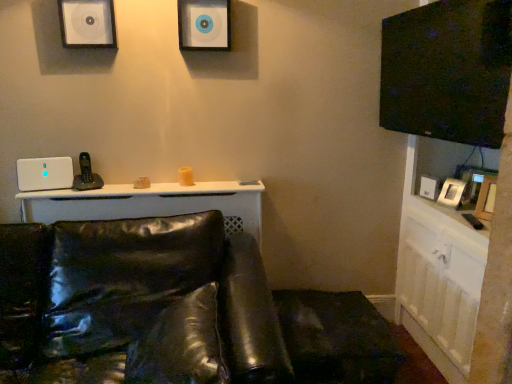
At what (x,y) coordinates should I click in order to perform the action: click on matte white speaker at upper center, the first speaker from the right. Please return your answer as a coordinate pair (x, y). Image resolution: width=512 pixels, height=384 pixels. Looking at the image, I should click on (204, 24).

Describe the element at coordinates (87, 23) in the screenshot. This screenshot has height=384, width=512. I see `white matte speaker at upper left, marked as the second speaker in a top-to-bottom arrangement` at that location.

I want to click on white plastic speaker at left, which is the first speaker from left to right, so click(45, 173).

In the image, there is a white plastic speaker at left, which is the first speaker from left to right. Where is `studio couch below it (from a real-world perspective)`? This screenshot has width=512, height=384. studio couch below it (from a real-world perspective) is located at coordinates (173, 310).

Between white plastic speaker at left, positioned as the third speaker in top-to-bottom order, and glossy leather couch at lower left, which one has smaller width?

white plastic speaker at left, positioned as the third speaker in top-to-bottom order, is thinner.

Does white plastic speaker at left, which appears as the third speaker when viewed from the right, come behind glossy leather couch at lower left?

Yes, white plastic speaker at left, which appears as the third speaker when viewed from the right, is behind glossy leather couch at lower left.

Based on the photo, is white plastic speaker at left, placed as the 1th speaker when sorted from bottom to top, beside glossy leather couch at lower left?

They are not placed beside each other.

Are glossy leather couch at lower left and white matte speaker at upper left, placed as the 2th speaker when sorted from left to right, making contact?

glossy leather couch at lower left and white matte speaker at upper left, placed as the 2th speaker when sorted from left to right, are clearly separated.

Does point (214, 376) lie behind point (83, 41)?

That is False.

Is glossy leather couch at lower left aimed at white matte speaker at upper left, marked as the second speaker in a bottom-to-top arrangement?

No, glossy leather couch at lower left does not turn towards white matte speaker at upper left, marked as the second speaker in a bottom-to-top arrangement.

Is point (434, 154) more distant than point (60, 11)?

Yes, it is behind point (60, 11).

Is white glossy dresser at right oriented away from white matte speaker at upper left, marked as the second speaker in a bottom-to-top arrangement?

No.

Which object is more forward, white glossy dresser at right or white matte speaker at upper left, marked as the second speaker in a top-to-bottom arrangement?

white glossy dresser at right is closer to the camera.

From a real-world perspective, is white glossy dresser at right located beneath white matte speaker at upper left, marked as the second speaker in a top-to-bottom arrangement?

Yes, from a real-world perspective, white glossy dresser at right is beneath white matte speaker at upper left, marked as the second speaker in a top-to-bottom arrangement.

Consider the image. Is white matte speaker at upper left, marked as the second speaker in a top-to-bottom arrangement, aimed at matte white speaker at upper center, the first speaker from the right?

No.

Is white matte speaker at upper left, placed as the 2th speaker when sorted from left to right, outside of matte white speaker at upper center, positioned as the 1th speaker in top-to-bottom order?

Yes.

Considering the points (81, 14) and (207, 6), which point is behind, point (81, 14) or point (207, 6)?

The point (207, 6) is farther.

Is glossy leather couch at lower left shorter than matte white speaker at upper center, the first speaker from the right?

In fact, glossy leather couch at lower left may be taller than matte white speaker at upper center, the first speaker from the right.

The height and width of the screenshot is (384, 512). In order to click on studio couch below the matte white speaker at upper center, the first speaker from the right (from a real-world perspective) in this screenshot , I will do `click(173, 310)`.

Is glossy leather couch at lower left touching matte white speaker at upper center, positioned as the 1th speaker in top-to-bottom order?

No, glossy leather couch at lower left is not with matte white speaker at upper center, positioned as the 1th speaker in top-to-bottom order.

Considering the relative sizes of glossy leather couch at lower left and matte white speaker at upper center, which is the 3th speaker from left to right, in the image provided, is glossy leather couch at lower left thinner than matte white speaker at upper center, which is the 3th speaker from left to right,?

No, glossy leather couch at lower left is not thinner than matte white speaker at upper center, which is the 3th speaker from left to right.

Is white matte speaker at upper left, arranged as the second speaker when viewed from the right, taller or shorter than white glossy dresser at right?

In the image, white matte speaker at upper left, arranged as the second speaker when viewed from the right, appears to be shorter than white glossy dresser at right.

Where is `the 1st speaker behind the white glossy dresser at right`? This screenshot has width=512, height=384. the 1st speaker behind the white glossy dresser at right is located at coordinates point(87,23).

Consider the image. Considering the sizes of objects white matte speaker at upper left, marked as the second speaker in a bottom-to-top arrangement, and white glossy dresser at right in the image provided, who is bigger, white matte speaker at upper left, marked as the second speaker in a bottom-to-top arrangement, or white glossy dresser at right?

white glossy dresser at right is bigger.

Is matte white speaker at upper center, the 3th speaker positioned from the bottom, bigger than white matte speaker at upper left, marked as the second speaker in a bottom-to-top arrangement?

Yes.

Considering the positions of objects matte white speaker at upper center, the 3th speaker positioned from the bottom, and white matte speaker at upper left, marked as the second speaker in a top-to-bottom arrangement, in the image provided, who is more to the left, matte white speaker at upper center, the 3th speaker positioned from the bottom, or white matte speaker at upper left, marked as the second speaker in a top-to-bottom arrangement,?

white matte speaker at upper left, marked as the second speaker in a top-to-bottom arrangement.

Is matte white speaker at upper center, positioned as the 1th speaker in top-to-bottom order, facing towards white matte speaker at upper left, placed as the 2th speaker when sorted from left to right?

No, matte white speaker at upper center, positioned as the 1th speaker in top-to-bottom order, is not oriented towards white matte speaker at upper left, placed as the 2th speaker when sorted from left to right.

From a real-world perspective, is matte white speaker at upper center, the first speaker from the right, located beneath white matte speaker at upper left, placed as the 2th speaker when sorted from left to right?

Yes, from a real-world perspective, matte white speaker at upper center, the first speaker from the right, is below white matte speaker at upper left, placed as the 2th speaker when sorted from left to right.

This screenshot has width=512, height=384. In order to click on the 1st speaker above when counting from the glossy leather couch at lower left (from the image's perspective) in this screenshot , I will do `click(45, 173)`.

Identify the location of studio couch directly beneath the white matte speaker at upper left, arranged as the second speaker when viewed from the right (from a real-world perspective). 173,310.

Considering their positions, is white matte speaker at upper left, arranged as the second speaker when viewed from the right, positioned further to white glossy dresser at right than glossy leather couch at lower left?

white matte speaker at upper left, arranged as the second speaker when viewed from the right, is positioned further to the anchor white glossy dresser at right.

Considering their positions, is white plastic speaker at left, positioned as the third speaker in top-to-bottom order, positioned further to white glossy dresser at right than glossy leather couch at lower left?

The object further to white glossy dresser at right is white plastic speaker at left, positioned as the third speaker in top-to-bottom order.

Considering their positions, is white plastic speaker at left, which appears as the third speaker when viewed from the right, positioned further to white glossy dresser at right than matte white speaker at upper center, the 3th speaker positioned from the bottom?

white plastic speaker at left, which appears as the third speaker when viewed from the right.

Which object lies further to the anchor point glossy leather couch at lower left, white matte speaker at upper left, marked as the second speaker in a bottom-to-top arrangement, or matte white speaker at upper center, positioned as the 1th speaker in top-to-bottom order?

Among the two, white matte speaker at upper left, marked as the second speaker in a bottom-to-top arrangement, is located further to glossy leather couch at lower left.

Looking at the image, which one is located further to white glossy dresser at right, glossy leather couch at lower left or white matte speaker at upper left, marked as the second speaker in a top-to-bottom arrangement?

The object further to white glossy dresser at right is white matte speaker at upper left, marked as the second speaker in a top-to-bottom arrangement.

Which object lies further to the anchor point glossy leather couch at lower left, matte white speaker at upper center, the first speaker from the right, or white matte speaker at upper left, marked as the second speaker in a bottom-to-top arrangement?

white matte speaker at upper left, marked as the second speaker in a bottom-to-top arrangement.

Considering their positions, is glossy leather couch at lower left positioned further to white matte speaker at upper left, marked as the second speaker in a bottom-to-top arrangement, than white plastic speaker at left, positioned as the third speaker in top-to-bottom order?

glossy leather couch at lower left lies further to white matte speaker at upper left, marked as the second speaker in a bottom-to-top arrangement, than the other object.

Looking at the image, which one is located closer to white matte speaker at upper left, arranged as the second speaker when viewed from the right, glossy leather couch at lower left or matte white speaker at upper center, positioned as the 1th speaker in top-to-bottom order?

matte white speaker at upper center, positioned as the 1th speaker in top-to-bottom order, is positioned closer to the anchor white matte speaker at upper left, arranged as the second speaker when viewed from the right.

This screenshot has height=384, width=512. What are the coordinates of `studio couch between white plastic speaker at left, which is the first speaker from left to right, and white glossy dresser at right` in the screenshot? It's located at [x=173, y=310].

I want to click on speaker between white matte speaker at upper left, arranged as the second speaker when viewed from the right, and white glossy dresser at right from left to right, so click(x=204, y=24).

At what (x,y) coordinates should I click in order to perform the action: click on speaker between glossy leather couch at lower left and white glossy dresser at right. Please return your answer as a coordinate pair (x, y). Looking at the image, I should click on (204, 24).

Find the location of a particular element. speaker between white matte speaker at upper left, arranged as the second speaker when viewed from the right, and glossy leather couch at lower left vertically is located at coordinates (45, 173).